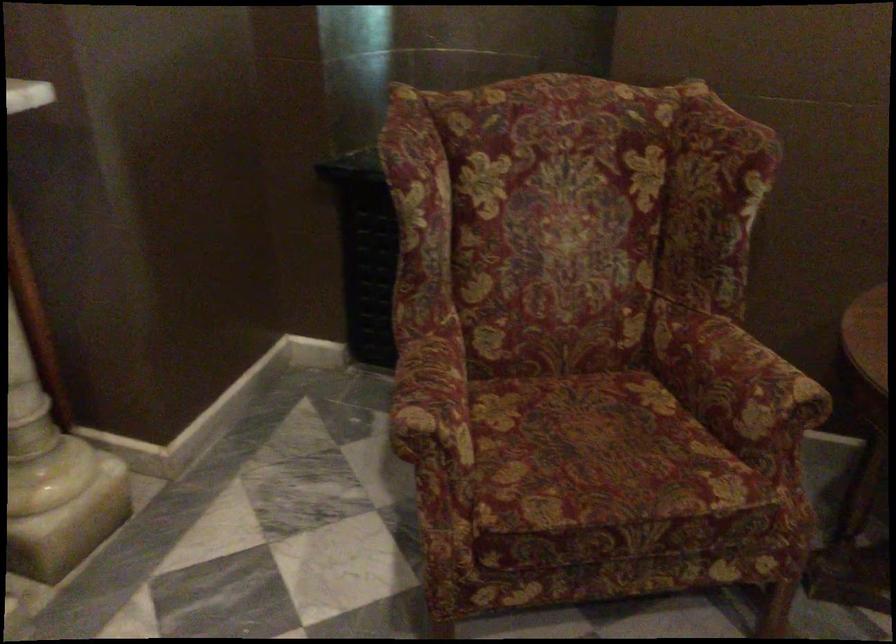
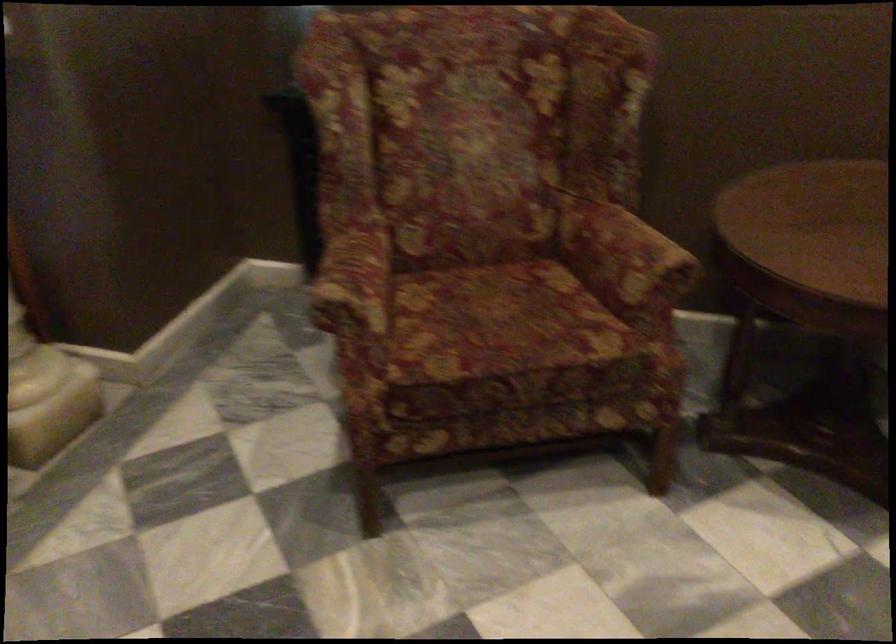
Question: How did the camera likely rotate?

Choices:
 (A) Left
 (B) Right
 (C) Up
 (D) Down

Answer: (D)